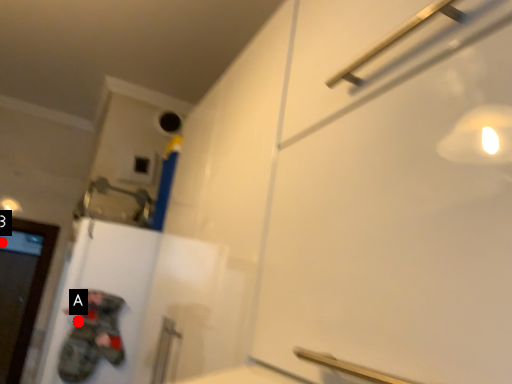
Question: Two points are circled on the image, labeled by A and B beside each circle. Which point is closer to the camera?

Choices:
 (A) A is closer
 (B) B is closer

Answer: (A)